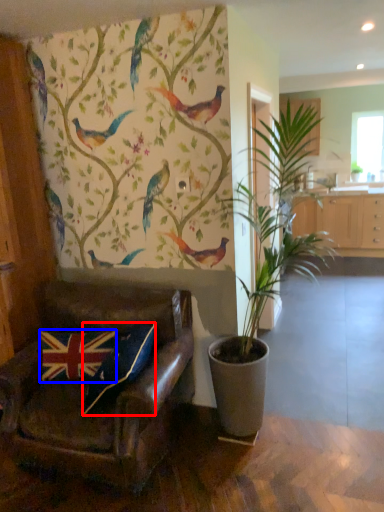
Question: Among these objects, which one is farthest to the camera, pillow (highlighted by a red box) or pillow (highlighted by a blue box)?

Choices:
 (A) pillow
 (B) pillow

Answer: (B)